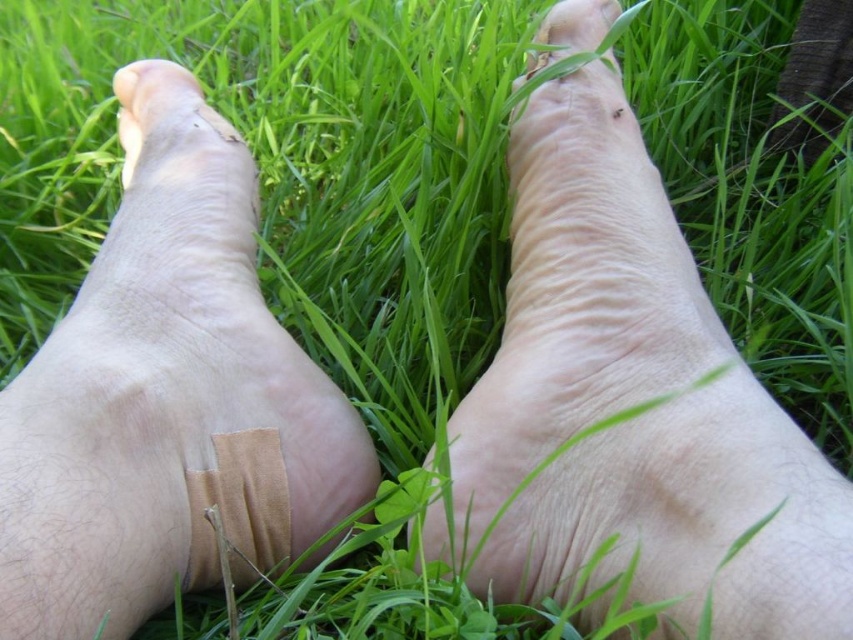
Question: Which object appears closest to the camera in this image?

Choices:
 (A) pale skin toe at upper left
 (B) smooth skin leg at upper right

Answer: (B)

Question: Which point appears farthest from the camera in this image?

Choices:
 (A) (756, 540)
 (B) (141, 80)
 (C) (192, 490)
 (D) (213, 358)

Answer: (B)

Question: Is smooth skin leg at upper right to the left of pale skin toe at upper left from the viewer's perspective?

Choices:
 (A) no
 (B) yes

Answer: (A)

Question: Observing the image, what is the correct spatial positioning of smooth skin leg at upper right in reference to beige fabric bandage at center?

Choices:
 (A) right
 (B) left

Answer: (A)

Question: Which point is farther to the camera?

Choices:
 (A) (230, 490)
 (B) (747, 481)

Answer: (A)

Question: Is smooth skin leg at upper right closer to the viewer compared to beige fabric bandage at center?

Choices:
 (A) no
 (B) yes

Answer: (B)